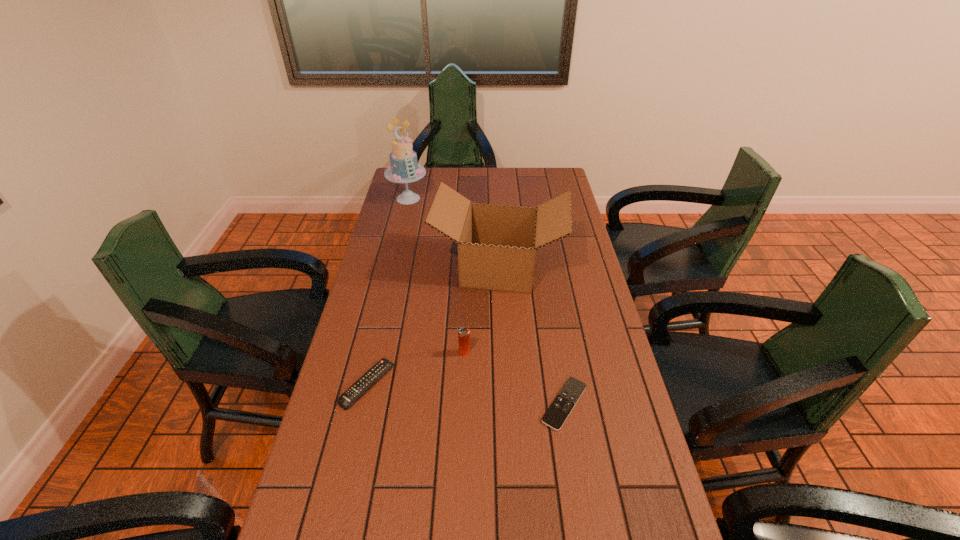
This screenshot has width=960, height=540. I want to click on the tallest object, so click(403, 168).

This screenshot has height=540, width=960. Find the location of `cake`. cake is located at coordinates (403, 168).

Where is `the second farthest object`? The height and width of the screenshot is (540, 960). the second farthest object is located at coordinates (497, 244).

Identify the location of the fourth shortest object. [x=497, y=244].

At what (x,y) coordinates should I click in order to perform the action: click on igniter. Please return your answer as a coordinate pair (x, y). The image size is (960, 540). Looking at the image, I should click on (463, 334).

Where is `the third farthest object`? the third farthest object is located at coordinates (463, 334).

The image size is (960, 540). What are the coordinates of `the second shortest object` in the screenshot? It's located at (353, 393).

This screenshot has width=960, height=540. Find the location of `the left remote control`. the left remote control is located at coordinates (353, 393).

I want to click on the right remote control, so click(x=561, y=407).

This screenshot has width=960, height=540. I want to click on the shortest object, so click(561, 407).